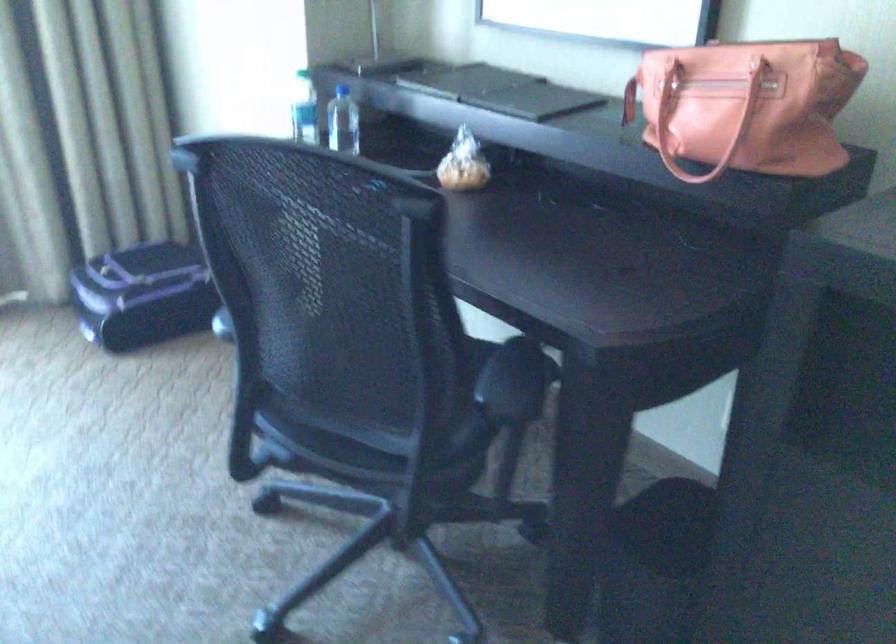
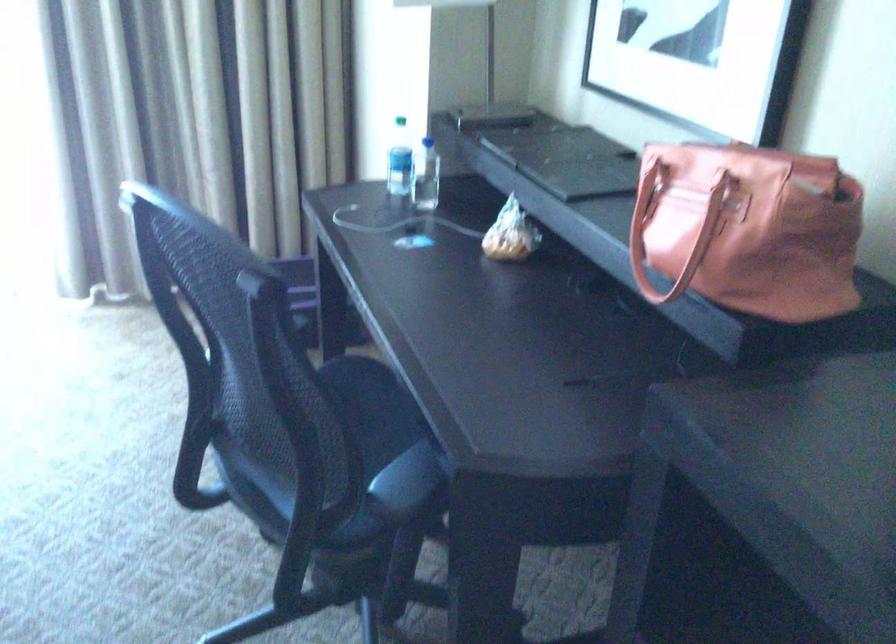
Question: The camera is either moving clockwise (left) or counter-clockwise (right) around the object. The first image is from the beginning of the video and the second image is from the end. Is the camera moving left or right when shooting the video?

Choices:
 (A) Left
 (B) Right

Answer: (B)